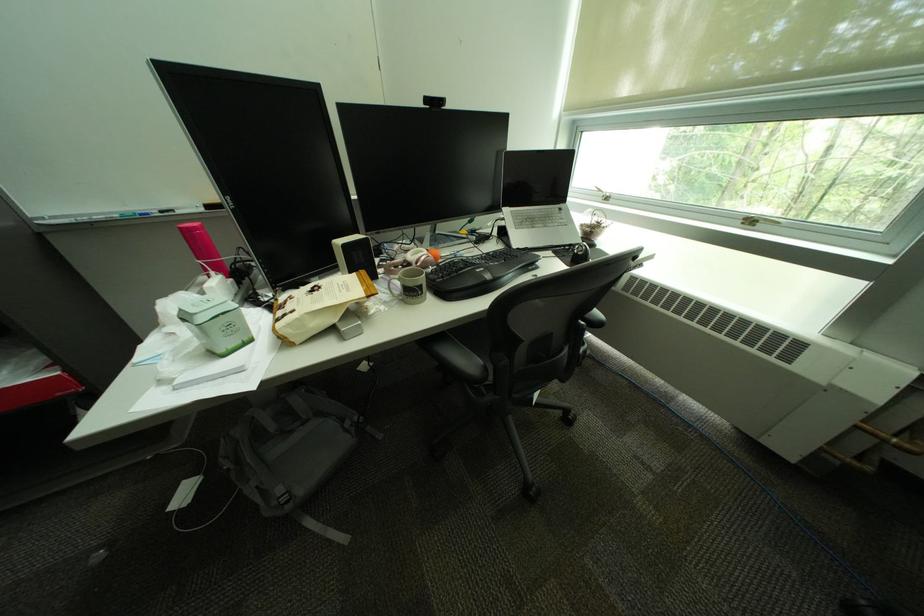
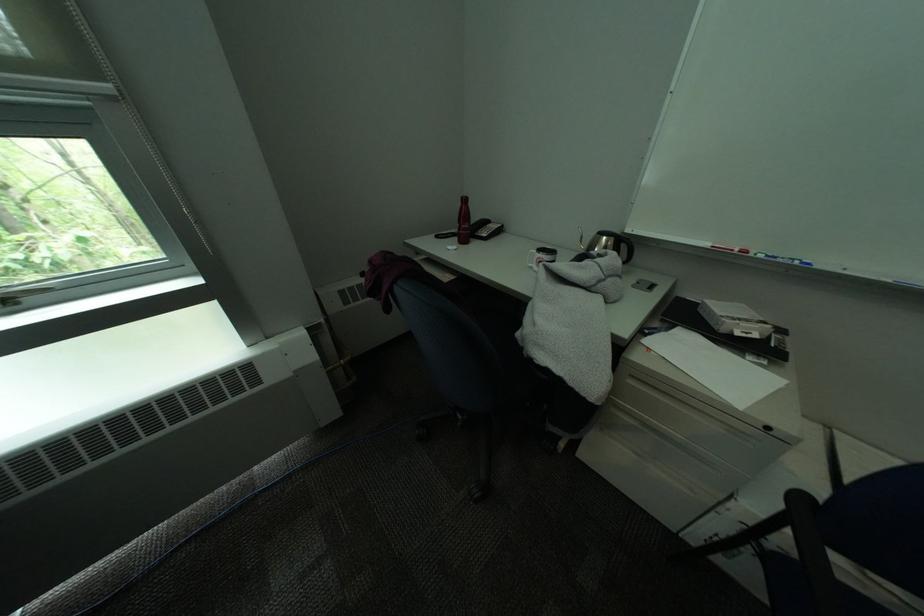
Find the pixel in the second image that matches point (761, 224) in the first image.

(15, 302)